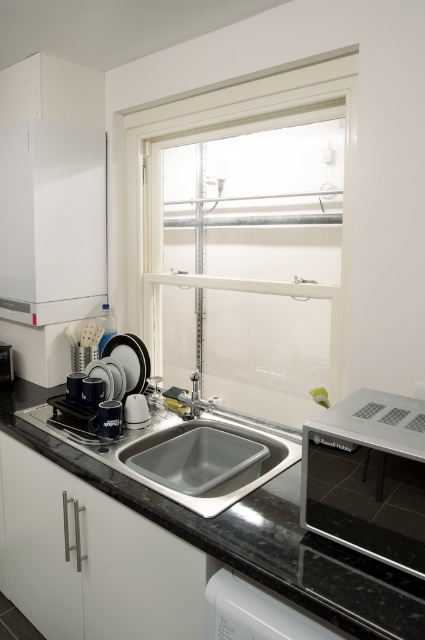
You are organizing the kitchen and want to place a new appliance that requires a space wider than the gray matte sink at center. Can the white matte cabinet at left provide enough width for this appliance?

The white matte cabinet at left has a width less than the gray matte sink at center, so it cannot accommodate an appliance requiring more space than the sink.

You are a kitchen designer planning to install a new appliance. You have a brushed metal toaster at lower left and a white glass window at center. Which appliance is located below the other?

The brushed metal toaster at lower left is located below the white glass window at center because the white glass window at center is positioned over the brushed metal toaster at lower left.